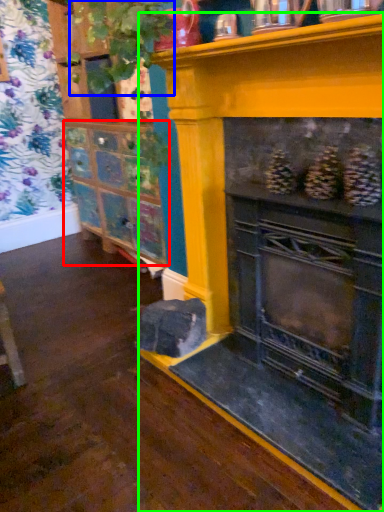
Question: Which object is the closest to the shelf (highlighted by a red box)? Choose among these: plant (highlighted by a blue box) or fireplace (highlighted by a green box).

Choices:
 (A) plant
 (B) fireplace

Answer: (B)